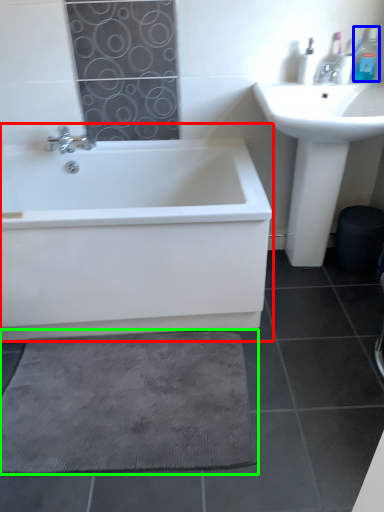
Question: Which object is positioned farthest from bathtub (highlighted by a red box)? Select from toiletry (highlighted by a blue box) and bath mat (highlighted by a green box).

Choices:
 (A) toiletry
 (B) bath mat

Answer: (A)